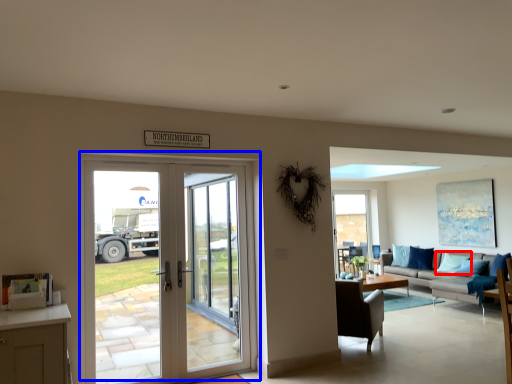
Question: Which object is further to the camera taking this photo, pillow (highlighted by a red box) or door (highlighted by a blue box)?

Choices:
 (A) pillow
 (B) door

Answer: (A)